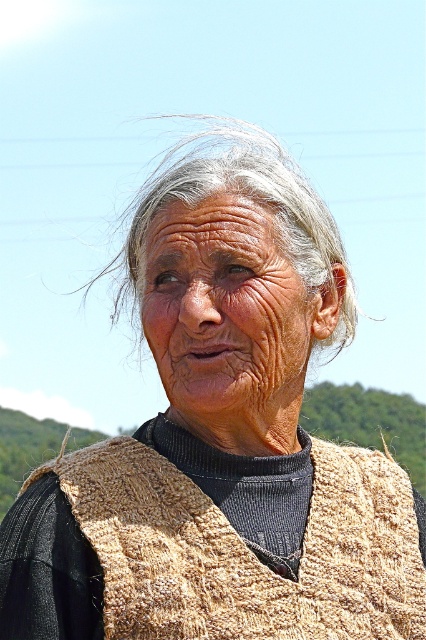
Is dry skin at center below gray woolen hair at center?

Yes, dry skin at center is below gray woolen hair at center.

Which of these two, dry skin at center or gray woolen hair at center, stands taller?

gray woolen hair at center

Between point (155, 342) and point (328, 288), which one is positioned in front?

Point (155, 342)

Where is `dry skin at center`? dry skin at center is located at coordinates (226, 314).

Image resolution: width=426 pixels, height=640 pixels. What do you see at coordinates (247, 550) in the screenshot?
I see `knitted beige shawl at center` at bounding box center [247, 550].

Which of these two, knitted beige shawl at center or gray woolen hair at center, stands shorter?

With less height is knitted beige shawl at center.

Is point (371, 477) behind point (143, 262)?

Yes, it is behind point (143, 262).

Locate an element on the screen. Image resolution: width=426 pixels, height=640 pixels. knitted beige shawl at center is located at coordinates (247, 550).

Does knitted beige shawl at center have a greater height compared to dry skin at center?

In fact, knitted beige shawl at center may be shorter than dry skin at center.

Between point (304, 637) and point (152, 220), which one is positioned behind?

Positioned behind is point (152, 220).

Describe the element at coordinates (247, 550) in the screenshot. I see `knitted beige shawl at center` at that location.

In order to click on knitted beige shawl at center in this screenshot , I will do `click(247, 550)`.